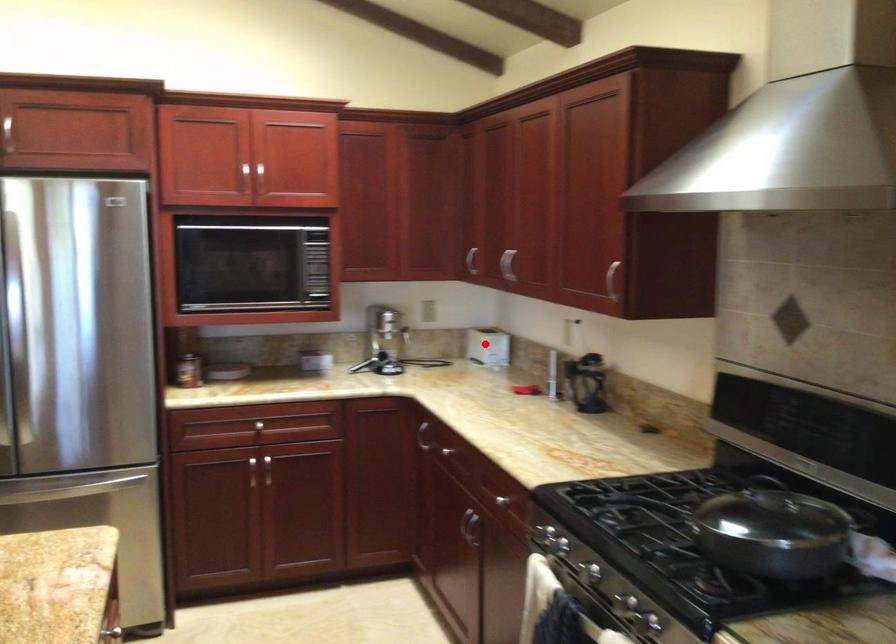
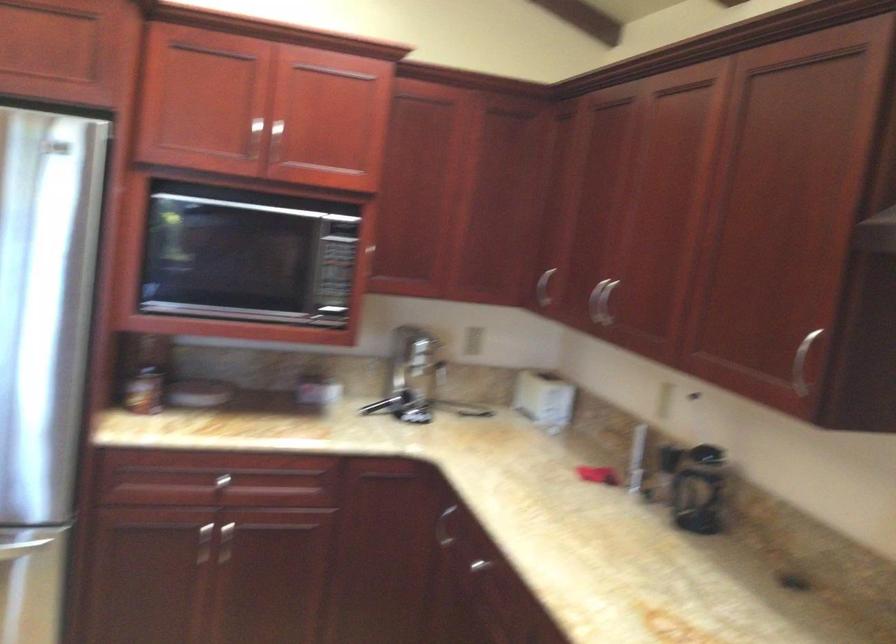
Question: I am providing you with two images of the same scene from different viewpoints. A red point is marked on the first image. Can you still see the location of the red point in image 2?

Choices:
 (A) Yes
 (B) No

Answer: (A)